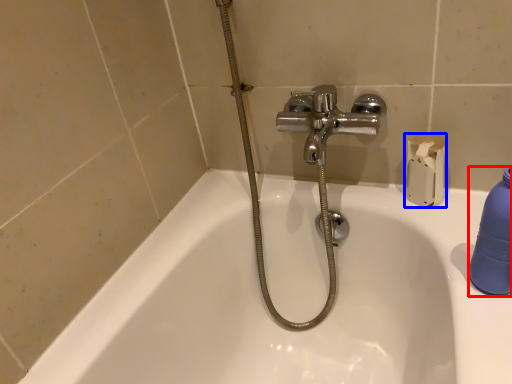
Question: Which point is further to the camera, cleaning product (highlighted by a red box) or toilet paper (highlighted by a blue box)?

Choices:
 (A) cleaning product
 (B) toilet paper

Answer: (B)